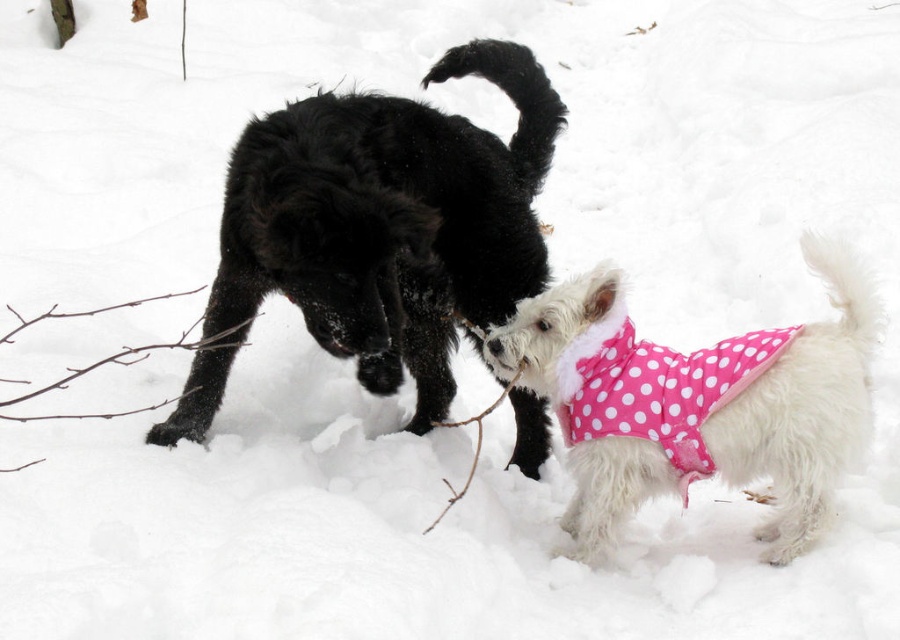
Question: Among these points, which one is nearest to the camera?

Choices:
 (A) (699, 376)
 (B) (272, 184)
 (C) (753, 460)

Answer: (B)

Question: Does pink polka dot fabric at lower right appear on the right side of pink polka dot fabric at right?

Choices:
 (A) no
 (B) yes

Answer: (B)

Question: Can you confirm if pink polka dot fabric at lower right is bigger than pink polka dot fabric at right?

Choices:
 (A) yes
 (B) no

Answer: (A)

Question: Can you confirm if pink polka dot fabric at lower right is positioned below pink polka dot fabric at right?

Choices:
 (A) yes
 (B) no

Answer: (A)

Question: Among these objects, which one is farthest from the camera?

Choices:
 (A) shiny black fur at center
 (B) pink polka dot fabric at lower right

Answer: (B)

Question: Which of the following is the farthest from the observer?

Choices:
 (A) pink polka dot fabric at right
 (B) pink polka dot fabric at lower right

Answer: (A)